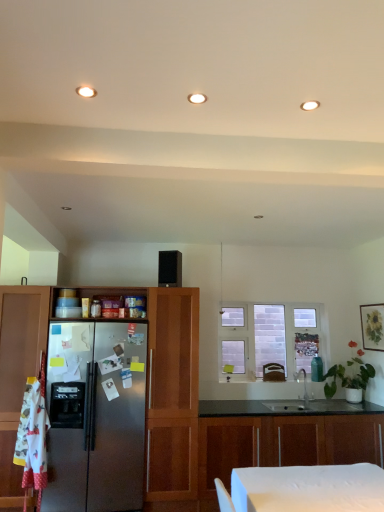
Question: Is matte wooden picture frame at upper right inside satin nickel faucet at center?

Choices:
 (A) no
 (B) yes

Answer: (A)

Question: Can you confirm if satin nickel faucet at center is bigger than matte wooden picture frame at upper right?

Choices:
 (A) yes
 (B) no

Answer: (A)

Question: Is satin nickel faucet at center further to camera compared to matte wooden picture frame at upper right?

Choices:
 (A) no
 (B) yes

Answer: (B)

Question: From a real-world perspective, is satin nickel faucet at center on top of matte wooden picture frame at upper right?

Choices:
 (A) no
 (B) yes

Answer: (A)

Question: Is matte wooden picture frame at upper right at the back of satin nickel faucet at center?

Choices:
 (A) yes
 (B) no

Answer: (B)

Question: Does satin nickel faucet at center have a greater width compared to matte wooden picture frame at upper right?

Choices:
 (A) no
 (B) yes

Answer: (B)

Question: Is satin nickel faucet at center closer to the viewer compared to satin wood cabinet at left, acting as the first cabinetry starting from the top?

Choices:
 (A) yes
 (B) no

Answer: (B)

Question: Is there a large distance between satin nickel faucet at center and satin wood cabinet at left, the second cabinetry positioned from the bottom?

Choices:
 (A) yes
 (B) no

Answer: (A)

Question: Is satin nickel faucet at center taller than satin wood cabinet at left, acting as the first cabinetry starting from the top?

Choices:
 (A) no
 (B) yes

Answer: (A)

Question: Can you confirm if satin nickel faucet at center is positioned to the left of satin wood cabinet at left, acting as the first cabinetry starting from the top?

Choices:
 (A) yes
 (B) no

Answer: (B)

Question: From a real-world perspective, is satin nickel faucet at center located higher than satin wood cabinet at left, acting as the first cabinetry starting from the top?

Choices:
 (A) no
 (B) yes

Answer: (B)

Question: Is satin nickel faucet at center smaller than satin wood cabinet at left, the second cabinetry positioned from the bottom?

Choices:
 (A) no
 (B) yes

Answer: (B)

Question: Is matte wooden picture frame at upper right positioned with its back to brown leather swivel chair at center?

Choices:
 (A) no
 (B) yes

Answer: (A)